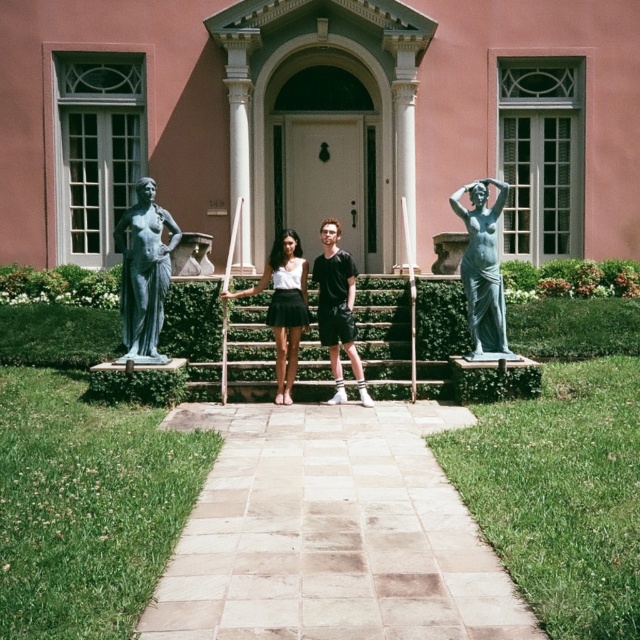
Measure the distance between point [385,365] and camera.

Point [385,365] and camera are 11.39 meters apart.

Which is above, wooden stairs at center or black matte shorts at center?

black matte shorts at center is above.

The width and height of the screenshot is (640, 640). I want to click on wooden stairs at center, so click(385, 333).

Does bronze statue at left have a greater width compared to matte green statue at right?

Correct, the width of bronze statue at left exceeds that of matte green statue at right.

Which of these two, bronze statue at left or matte green statue at right, stands taller?

With more height is matte green statue at right.

The height and width of the screenshot is (640, 640). Find the location of `bronze statue at left`. bronze statue at left is located at coordinates (145, 273).

You are a GUI agent. You are given a task and a screenshot of the screen. Output one action in this format:
    pyautogui.click(x=<x>, y=<y>)
    Task: Click on the bronze statue at left
    The image size is (640, 640).
    Given the screenshot: What is the action you would take?
    pyautogui.click(x=145, y=273)

Is bronze statue at left thinner than black matte shorts at center?

No.

Can you confirm if bronze statue at left is positioned above black matte shorts at center?

Yes, bronze statue at left is above black matte shorts at center.

Find the location of a particular element. Image resolution: width=640 pixels, height=640 pixels. bronze statue at left is located at coordinates (145, 273).